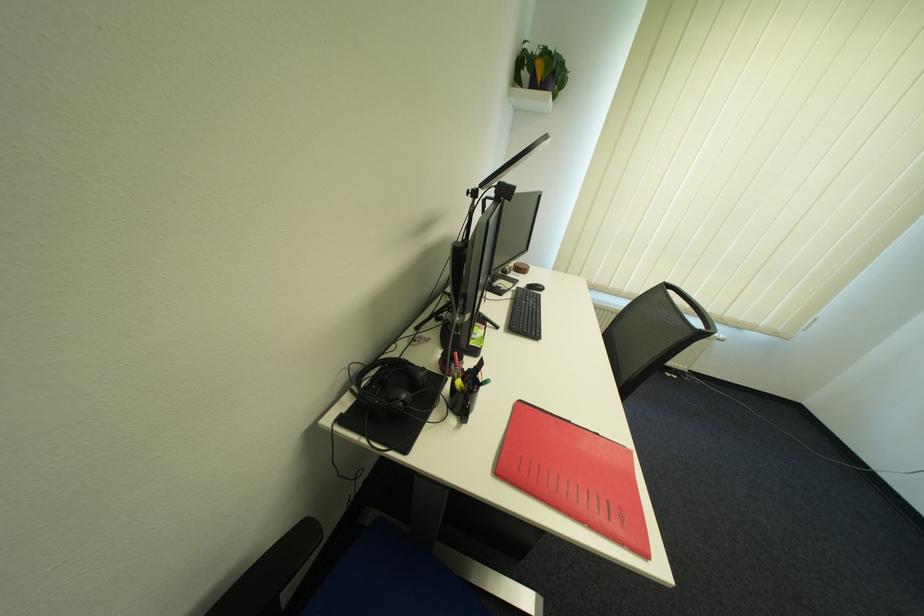
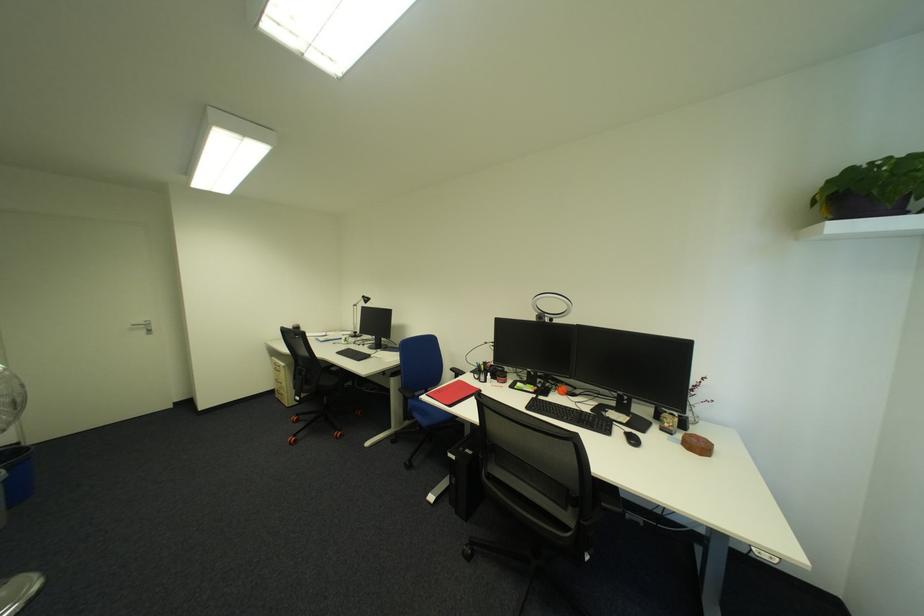
Find the pixel in the second image that matches point 555,69 in the first image.

(831, 200)